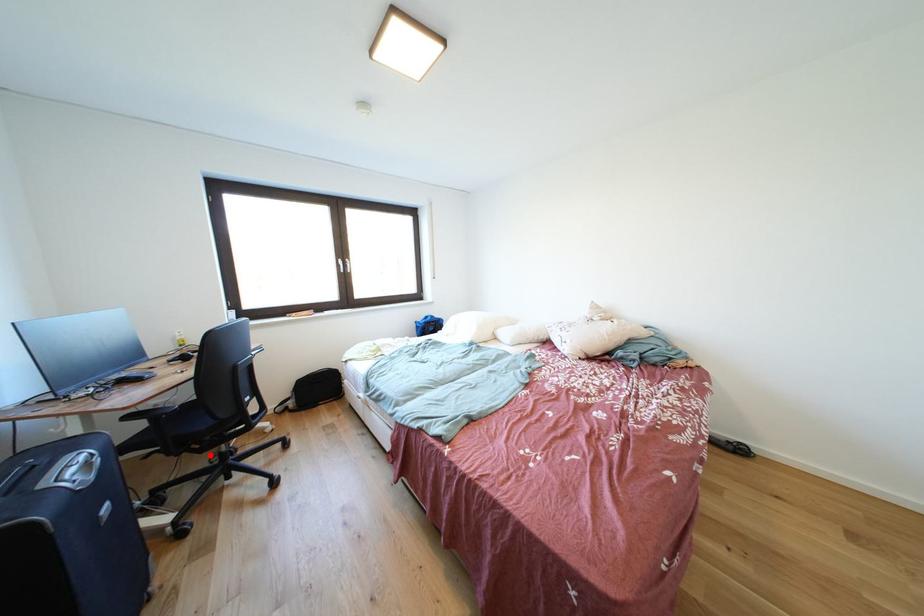
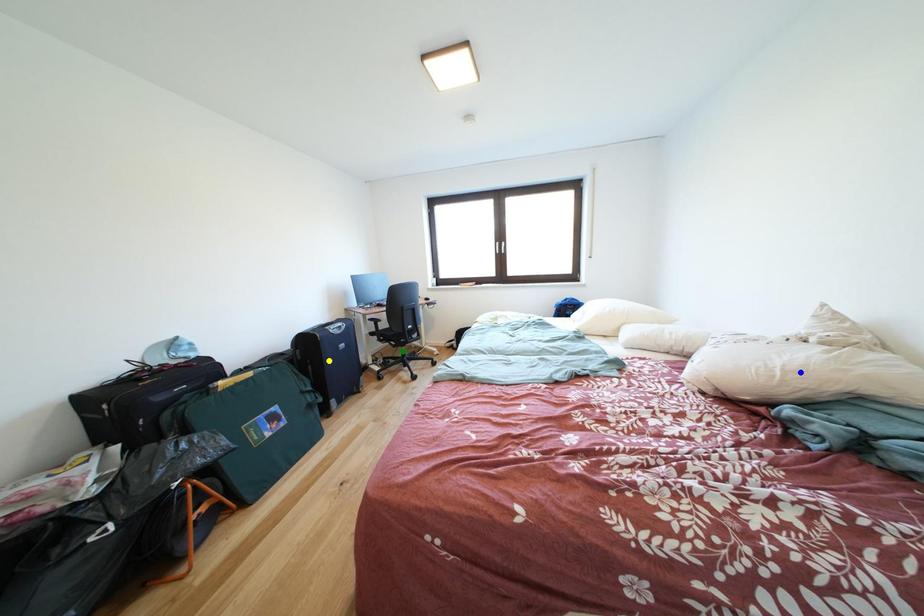
Question: I am providing you with two images of the same scene from different viewpoints. A red point is marked on the first image. You are given multiple points on the second image. Which point in image 2 represents the same 3d spot as the red point in image 1?

Choices:
 (A) green point
 (B) blue point
 (C) yellow point

Answer: (A)